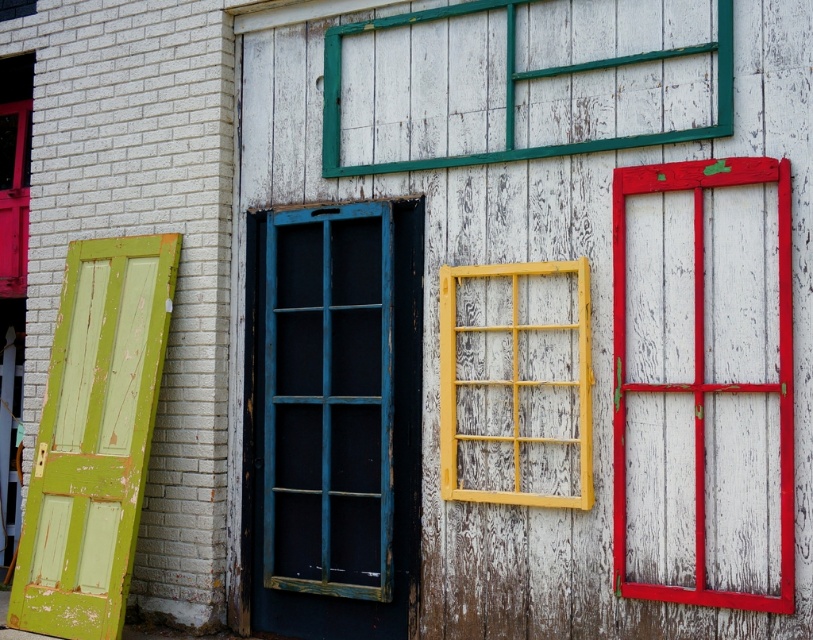
Is green matte door at left above yellow wood window at center?

No, green matte door at left is not above yellow wood window at center.

Can you confirm if green matte door at left is positioned to the left of yellow wood window at center?

Yes, green matte door at left is to the left of yellow wood window at center.

Is point (124, 321) closer to camera compared to point (506, 465)?

No, (124, 321) is behind (506, 465).

You are a GUI agent. You are given a task and a screenshot of the screen. Output one action in this format:
    pyautogui.click(x=<x>, y=<y>)
    Task: Click on the green matte door at left
    
    Given the screenshot: What is the action you would take?
    (94, 436)

Is green matte door at left thinner than matte red door at left?

No.

Is green matte door at left positioned in front of matte red door at left?

Yes.

Is point (74, 476) farther from viewer compared to point (2, 269)?

No.

The image size is (813, 640). I want to click on green matte door at left, so click(94, 436).

Is blue wooden window at center-left shorter than matte red door at left?

Incorrect, blue wooden window at center-left's height does not fall short of matte red door at left's.

Does point (324, 442) lie in front of point (12, 262)?

Yes.

Locate an element on the screen. blue wooden window at center-left is located at coordinates (328, 401).

Locate an element on the screen. Image resolution: width=813 pixels, height=640 pixels. blue wooden window at center-left is located at coordinates (328, 401).